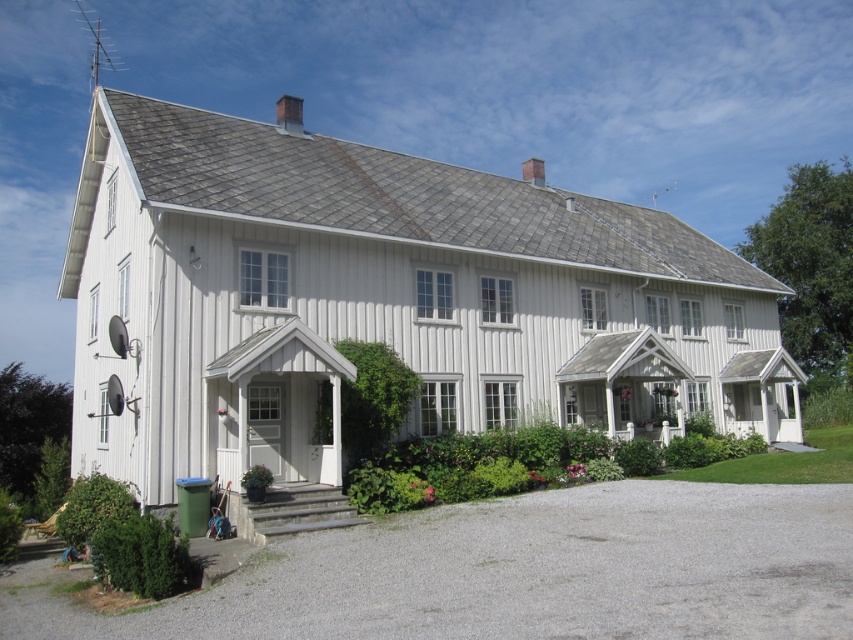
Question: Which of the following is the farthest from the observer?

Choices:
 (A) gray stone steps at lower center
 (B) gray gravel driveway at lower center

Answer: (A)

Question: Does gray gravel driveway at lower center have a greater width compared to gray stone steps at lower center?

Choices:
 (A) yes
 (B) no

Answer: (A)

Question: Is gray gravel driveway at lower center wider than gray stone steps at lower center?

Choices:
 (A) yes
 (B) no

Answer: (A)

Question: Does gray gravel driveway at lower center appear on the left side of gray stone steps at lower center?

Choices:
 (A) yes
 (B) no

Answer: (B)

Question: Which point is farther from the camera taking this photo?

Choices:
 (A) (314, 512)
 (B) (347, 556)

Answer: (A)